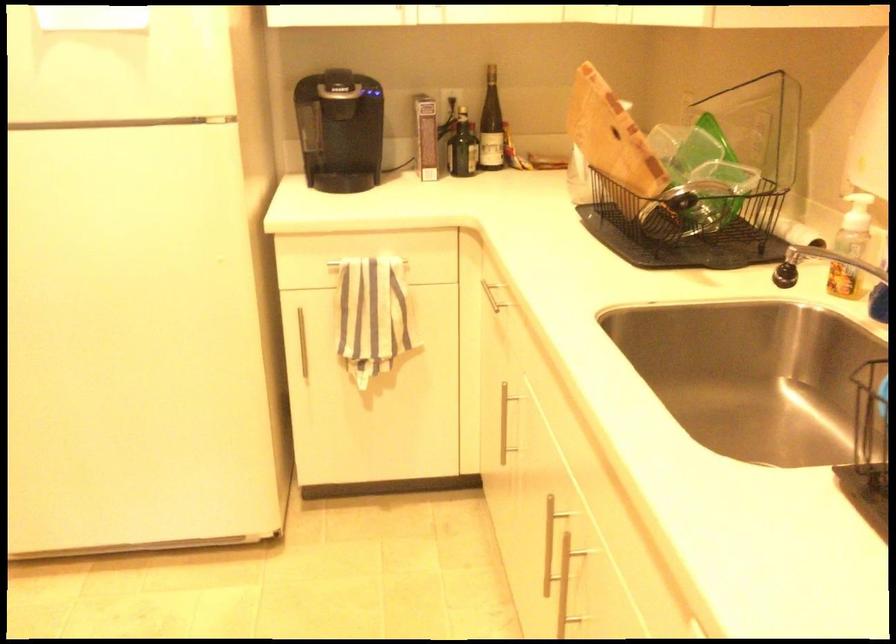
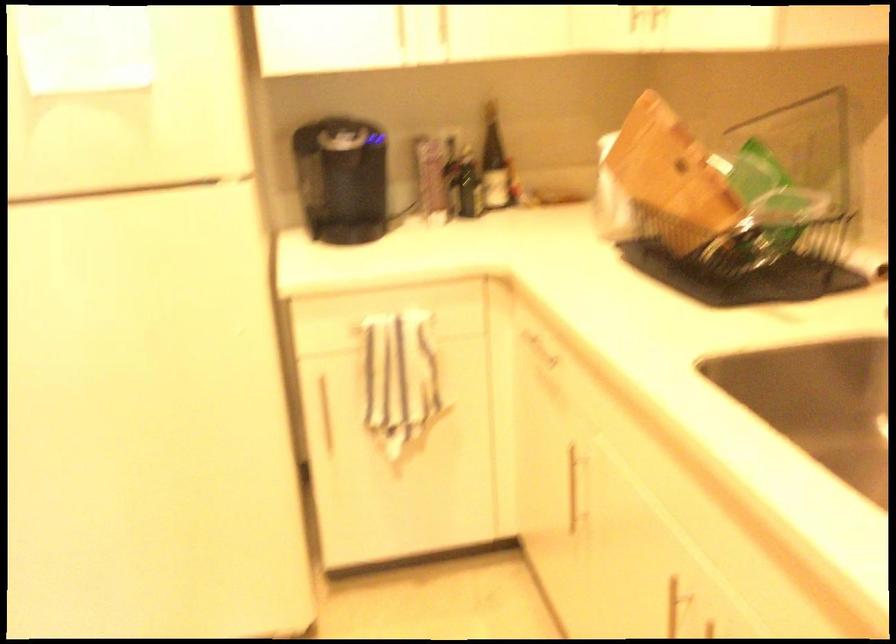
Find the pixel in the second image that matches the point at 297,344 in the first image.

(323, 412)